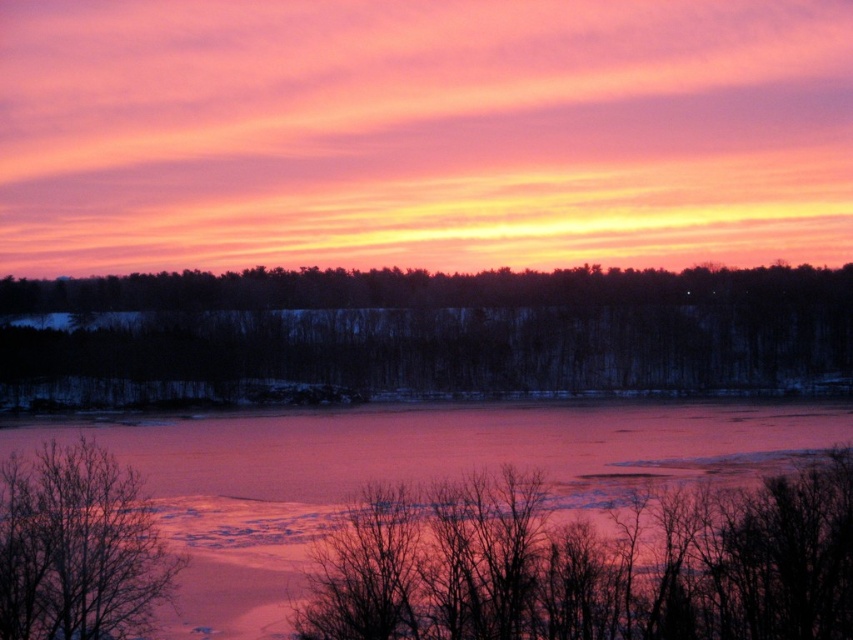
Question: Is dark brown bark at center to the left of pink ice at center from the viewer's perspective?

Choices:
 (A) yes
 (B) no

Answer: (B)

Question: Among these objects, which one is nearest to the camera?

Choices:
 (A) dark brown bark at center
 (B) pink ice at center
 (C) bare branches at lower left

Answer: (C)

Question: Can you confirm if dark brown bark at center is thinner than pink ice at center?

Choices:
 (A) yes
 (B) no

Answer: (B)

Question: Does dark brown bark at center have a lesser width compared to pink ice at center?

Choices:
 (A) yes
 (B) no

Answer: (B)

Question: Which of these objects is positioned closest to the pink ice at center?

Choices:
 (A) dark brown bark at center
 (B) bare branches at lower left

Answer: (B)

Question: Which object appears farthest from the camera in this image?

Choices:
 (A) pink ice at center
 (B) bare branches at lower left
 (C) dark brown bark at center

Answer: (C)